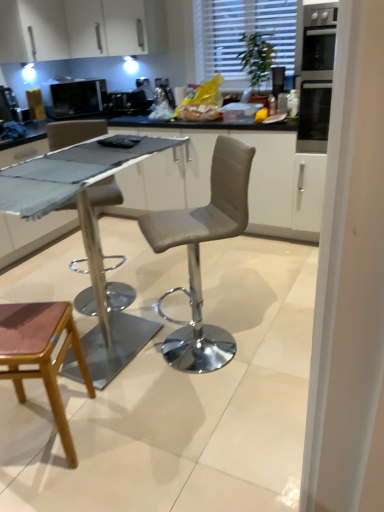
What do you see at coordinates (68, 174) in the screenshot?
I see `dark gray fabric-covered table at center` at bounding box center [68, 174].

This screenshot has width=384, height=512. What are the coordinates of `white glossy cabinet at upper left` in the screenshot? It's located at (33, 30).

At what (x,y) coordinates should I click in order to perform the action: click on satin black coffee machine at center, the 1th appliance from the right. Please return your answer as a coordinate pair (x, y). Looking at the image, I should click on (128, 102).

Image resolution: width=384 pixels, height=512 pixels. What are the coordinates of `white textured blinds at upper center` in the screenshot? It's located at tap(240, 35).

What is the approximate width of white textured blinds at upper center?

The width of white textured blinds at upper center is 8.69 centimeters.

Describe the element at coordinates (41, 354) in the screenshot. This screenshot has width=384, height=512. I see `pink leather stool at lower left` at that location.

What are the coordinates of `dark gray fabric-covered table at center` in the screenshot? It's located at (68, 174).

Find the location of a particular element. oven on the right of dark gray fabric-covered table at center is located at coordinates (316, 77).

Considering the sizes of objects dark gray fabric-covered table at center and black glass oven at upper right in the image provided, who is bigger, dark gray fabric-covered table at center or black glass oven at upper right?

With larger size is black glass oven at upper right.

Is dark gray fabric-covered table at center oriented away from black glass oven at upper right?

dark gray fabric-covered table at center does not have its back to black glass oven at upper right.

Are dark gray fabric-covered table at center and black glass oven at upper right making contact?

No, dark gray fabric-covered table at center is not next to black glass oven at upper right.

Looking at their sizes, would you say satin black coffee machine at center, the 1th appliance from the right, is wider or thinner than matte black microwave at upper left, placed as the second appliance when sorted from right to left?

Considering their sizes, satin black coffee machine at center, the 1th appliance from the right, looks broader than matte black microwave at upper left, placed as the second appliance when sorted from right to left.

Can you tell me how much satin black coffee machine at center, the 2th appliance positioned from the left, and matte black microwave at upper left, placed as the second appliance when sorted from right to left, differ in facing direction?

There is a 56-degree angle between the facing directions of satin black coffee machine at center, the 2th appliance positioned from the left, and matte black microwave at upper left, placed as the second appliance when sorted from right to left.

Could you tell me if satin black coffee machine at center, the 2th appliance positioned from the left, is turned towards matte black microwave at upper left, placed as the second appliance when sorted from right to left?

No, satin black coffee machine at center, the 2th appliance positioned from the left, is not turned towards matte black microwave at upper left, placed as the second appliance when sorted from right to left.

From a real-world perspective, which is physically below, satin black coffee machine at center, the 1th appliance from the right, or matte black microwave at upper left, placed as the second appliance when sorted from right to left?

In real-world perspective, satin black coffee machine at center, the 1th appliance from the right, is lower.

Is satin black coffee machine at center, the 2th appliance positioned from the left, surrounding black glass oven at upper right?

No, black glass oven at upper right is located outside of satin black coffee machine at center, the 2th appliance positioned from the left.

Can you see satin black coffee machine at center, the 2th appliance positioned from the left, touching black glass oven at upper right?

No, satin black coffee machine at center, the 2th appliance positioned from the left, is not making contact with black glass oven at upper right.

Is black glass oven at upper right at the back of satin black coffee machine at center, the 1th appliance from the right?

No.

Considering their positions, is satin black coffee machine at center, the 2th appliance positioned from the left, located in front of or behind black glass oven at upper right?

satin black coffee machine at center, the 2th appliance positioned from the left, is positioned farther from the viewer than black glass oven at upper right.

Is matte black microwave at upper left, placed as the second appliance when sorted from right to left, bigger or smaller than pink leather stool at lower left?

In the image, matte black microwave at upper left, placed as the second appliance when sorted from right to left, appears to be smaller than pink leather stool at lower left.

Considering the sizes of matte black microwave at upper left, placed as the second appliance when sorted from right to left, and pink leather stool at lower left in the image, is matte black microwave at upper left, placed as the second appliance when sorted from right to left, taller or shorter than pink leather stool at lower left?

Considering their sizes, matte black microwave at upper left, placed as the second appliance when sorted from right to left, has less height than pink leather stool at lower left.

Based on the photo, is matte black microwave at upper left, the 1th appliance in the left-to-right sequence, touching pink leather stool at lower left?

No, matte black microwave at upper left, the 1th appliance in the left-to-right sequence, is not next to pink leather stool at lower left.

Considering the positions of objects matte black microwave at upper left, placed as the second appliance when sorted from right to left, and pink leather stool at lower left in the image provided, who is behind, matte black microwave at upper left, placed as the second appliance when sorted from right to left, or pink leather stool at lower left?

Positioned behind is matte black microwave at upper left, placed as the second appliance when sorted from right to left.

From a real-world perspective, does white glossy cabinet at upper left stand above satin black coffee machine at center, the 1th appliance from the right?

Yes, from a real-world perspective, white glossy cabinet at upper left is on top of satin black coffee machine at center, the 1th appliance from the right.

Is white glossy cabinet at upper left not close to satin black coffee machine at center, the 1th appliance from the right?

white glossy cabinet at upper left is actually quite close to satin black coffee machine at center, the 1th appliance from the right.

Identify the location of the 2nd appliance behind the white glossy cabinet at upper left, starting your count from the anchor. (128, 102).

Considering the sizes of objects white glossy cabinet at upper left and black glass oven at upper right in the image provided, who is shorter, white glossy cabinet at upper left or black glass oven at upper right?

Standing shorter between the two is white glossy cabinet at upper left.

From the image's perspective, which object appears higher, white glossy cabinet at upper left or black glass oven at upper right?

From the image's view, white glossy cabinet at upper left is above.

Considering the relative sizes of white glossy cabinet at upper left and black glass oven at upper right in the image provided, is white glossy cabinet at upper left smaller than black glass oven at upper right?

Yes, white glossy cabinet at upper left is smaller than black glass oven at upper right.

Can we say white glossy cabinet at upper left lies outside black glass oven at upper right?

That's correct, white glossy cabinet at upper left is outside of black glass oven at upper right.

Which object is positioned more to the left, satin black coffee machine at center, the 1th appliance from the right, or white textured blinds at upper center?

From the viewer's perspective, satin black coffee machine at center, the 1th appliance from the right, appears more on the left side.

Identify the location of the 2nd appliance behind the white textured blinds at upper center. The image size is (384, 512). pos(128,102).

Which object is closer to the camera, satin black coffee machine at center, the 2th appliance positioned from the left, or white textured blinds at upper center?

white textured blinds at upper center is in front.

From a real-world perspective, who is located lower, satin black coffee machine at center, the 2th appliance positioned from the left, or white textured blinds at upper center?

satin black coffee machine at center, the 2th appliance positioned from the left, is physically lower.

I want to click on oven located above the dark gray fabric-covered table at center (from a real-world perspective), so click(316, 77).

I want to click on appliance lying on the left of satin black coffee machine at center, the 2th appliance positioned from the left, so click(74, 97).

Looking at the image, which one is located closer to satin black coffee machine at center, the 1th appliance from the right, white glossy cabinet at upper left or dark gray fabric-covered table at center?

white glossy cabinet at upper left.

Based on their spatial positions, is satin black coffee machine at center, the 2th appliance positioned from the left, or matte black microwave at upper left, placed as the second appliance when sorted from right to left, further from black glass oven at upper right?

Among the two, matte black microwave at upper left, placed as the second appliance when sorted from right to left, is located further to black glass oven at upper right.

Considering their positions, is white textured blinds at upper center positioned further to matte black microwave at upper left, placed as the second appliance when sorted from right to left, than satin black coffee machine at center, the 2th appliance positioned from the left?

white textured blinds at upper center is further to matte black microwave at upper left, placed as the second appliance when sorted from right to left.

Based on their spatial positions, is white glossy cabinet at upper left or pink leather stool at lower left further from satin black coffee machine at center, the 2th appliance positioned from the left?

pink leather stool at lower left is positioned further to the anchor satin black coffee machine at center, the 2th appliance positioned from the left.

Considering their positions, is pink leather stool at lower left positioned further to white textured blinds at upper center than black glass oven at upper right?

The object further to white textured blinds at upper center is pink leather stool at lower left.

Looking at the image, which one is located further to matte black microwave at upper left, placed as the second appliance when sorted from right to left, white glossy cabinet at upper left or dark gray fabric-covered table at center?

dark gray fabric-covered table at center lies further to matte black microwave at upper left, placed as the second appliance when sorted from right to left, than the other object.

Looking at the image, which one is located closer to black glass oven at upper right, white textured blinds at upper center or white glossy cabinet at upper left?

white textured blinds at upper center.

Estimate the real-world distances between objects in this image. Which object is closer to matte black microwave at upper left, the 1th appliance in the left-to-right sequence, black glass oven at upper right or white textured blinds at upper center?

white textured blinds at upper center is closer to matte black microwave at upper left, the 1th appliance in the left-to-right sequence.

You are a GUI agent. You are given a task and a screenshot of the screen. Output one action in this format:
    pyautogui.click(x=<x>, y=<y>)
    Task: Click on the oven between dark gray fabric-covered table at center and satin black coffee machine at center, the 1th appliance from the right, in the front-back direction
    The width and height of the screenshot is (384, 512).
    Given the screenshot: What is the action you would take?
    pyautogui.click(x=316, y=77)

I want to click on counter top between white glossy cabinet at upper left and pink leather stool at lower left in the up-down direction, so click(68, 174).

This screenshot has width=384, height=512. I want to click on cabinetry between dark gray fabric-covered table at center and satin black coffee machine at center, the 1th appliance from the right, from front to back, so click(33, 30).

Find the location of a particular element. window between dark gray fabric-covered table at center and satin black coffee machine at center, the 2th appliance positioned from the left, from front to back is located at coordinates (240, 35).